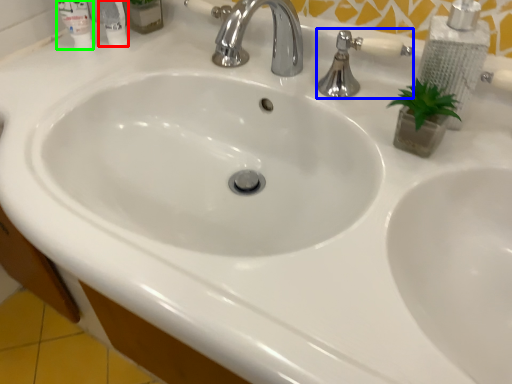
Question: Based on their relative distances, which object is farther from mouthwash (highlighted by a red box)? Choose from plumbing fixture (highlighted by a blue box) and mouthwash (highlighted by a green box).

Choices:
 (A) plumbing fixture
 (B) mouthwash

Answer: (A)